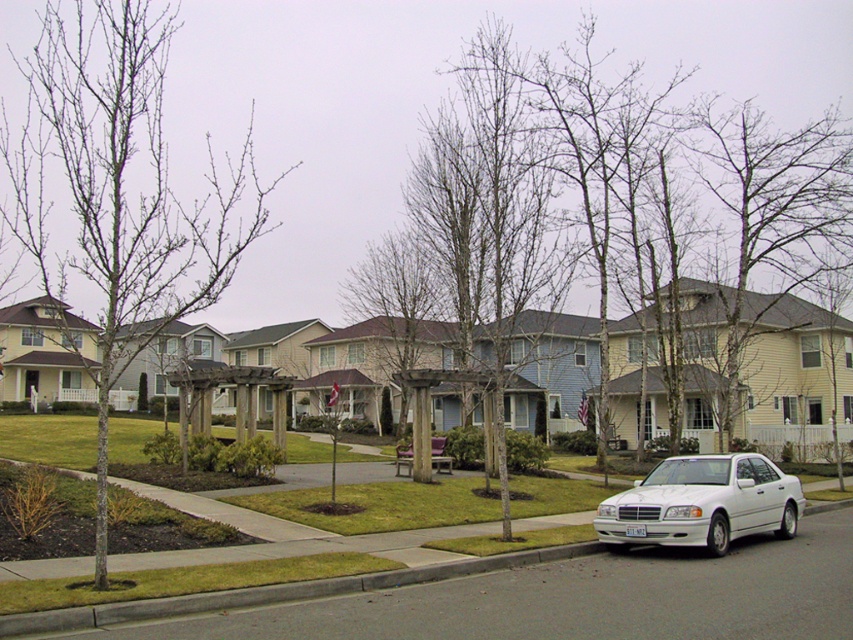
Question: Estimate the real-world distances between objects in this image. Which object is farther from the bare wood tree at left?

Choices:
 (A) bare wood tree at center
 (B) gray concrete curb at lower center
 (C) brown wood tree at center

Answer: (B)

Question: Among these points, which one is nearest to the camera?

Choices:
 (A) (364, 296)
 (B) (659, 317)

Answer: (B)

Question: Is bare branches at upper right smaller than brown wood tree at center?

Choices:
 (A) no
 (B) yes

Answer: (A)

Question: Does bare wood tree at left have a greater width compared to white glossy sedan at lower right?

Choices:
 (A) yes
 (B) no

Answer: (A)

Question: Among these points, which one is nearest to the camera?

Choices:
 (A) click(140, 348)
 (B) click(735, 266)
 (C) click(724, 460)
 (D) click(837, 253)

Answer: (A)

Question: Can you confirm if bare wood tree at left is positioned to the left of white glossy sedan at lower right?

Choices:
 (A) yes
 (B) no

Answer: (A)